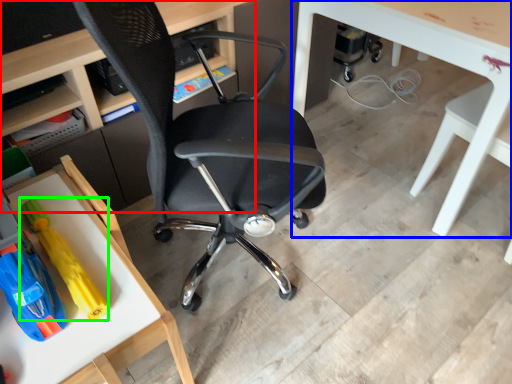
Question: Based on their relative distances, which object is farther from desk (highlighted by a red box)? Choose from table (highlighted by a blue box) and toy (highlighted by a green box).

Choices:
 (A) table
 (B) toy

Answer: (A)